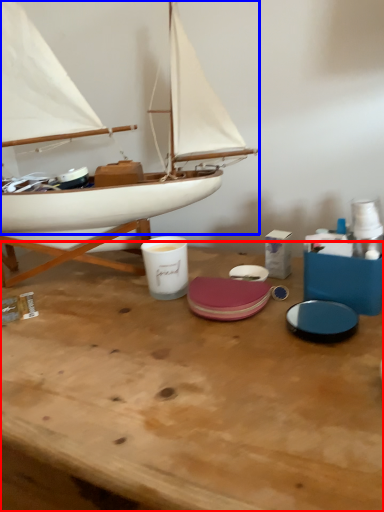
Question: Which object appears farthest to the camera in this image, table (highlighted by a red box) or boat (highlighted by a blue box)?

Choices:
 (A) table
 (B) boat

Answer: (B)